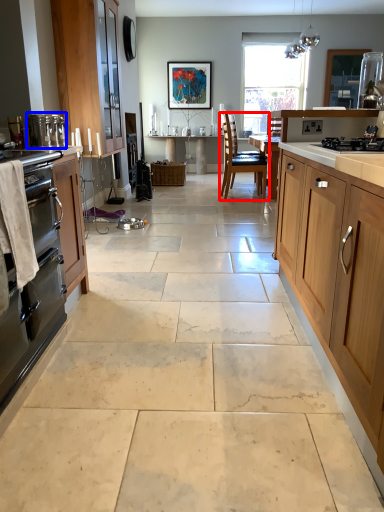
Question: Among these objects, which one is farthest to the camera, chair (highlighted by a red box) or appliance (highlighted by a blue box)?

Choices:
 (A) chair
 (B) appliance

Answer: (A)